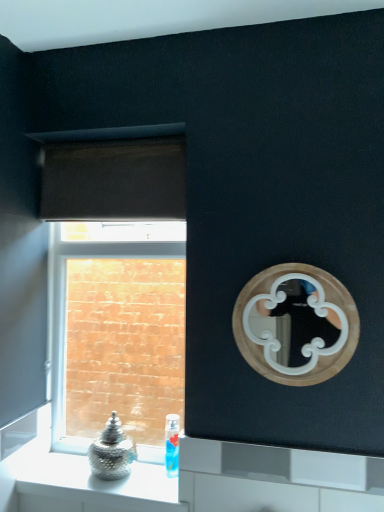
Where is `free space to the left of translucent plastic bottle at lower center`? The width and height of the screenshot is (384, 512). free space to the left of translucent plastic bottle at lower center is located at coordinates (131, 477).